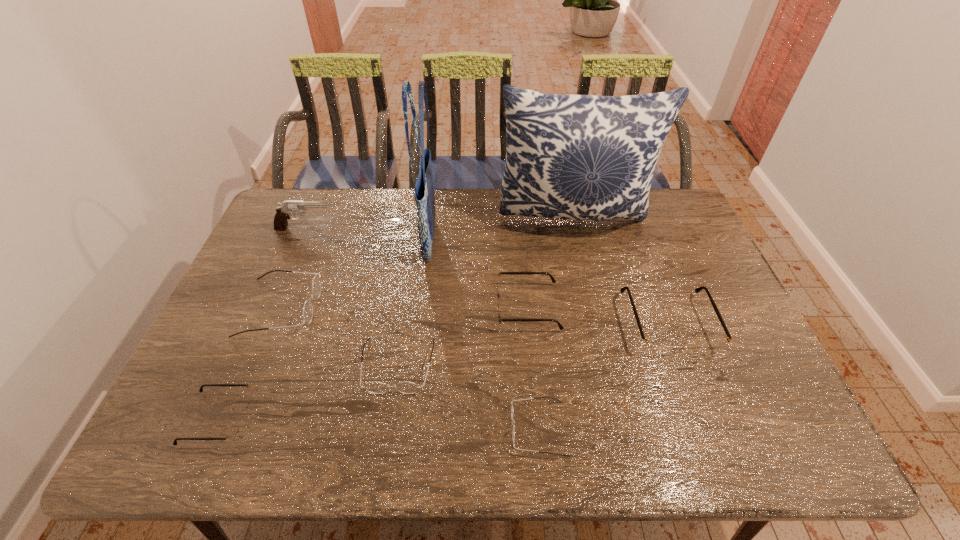
Identify the location of cushion that is at the right edge. The height and width of the screenshot is (540, 960). (580, 157).

At what (x,y) coordinates should I click in order to perform the action: click on spectacles located in the right edge section of the desktop. Please return your answer as a coordinate pair (x, y). The image size is (960, 540). Looking at the image, I should click on (657, 346).

I want to click on object located at the far left corner, so click(x=283, y=212).

Identify the location of object that is positioned at the near left corner. (233, 432).

Where is `object present at the far right corner`? Image resolution: width=960 pixels, height=540 pixels. object present at the far right corner is located at coordinates (580, 157).

Identify the location of vacant space at the far edge of the desktop. Image resolution: width=960 pixels, height=540 pixels. (506, 225).

Locate an element on the screen. The width and height of the screenshot is (960, 540). vacant space at the near edge of the desktop is located at coordinates (669, 453).

Where is `vacant space at the left edge of the desktop`? Image resolution: width=960 pixels, height=540 pixels. vacant space at the left edge of the desktop is located at coordinates pyautogui.click(x=231, y=375).

Image resolution: width=960 pixels, height=540 pixels. I want to click on free location at the right edge of the desktop, so click(715, 323).

Locate an element on the screen. free region at the far right corner of the desktop is located at coordinates coord(688,220).